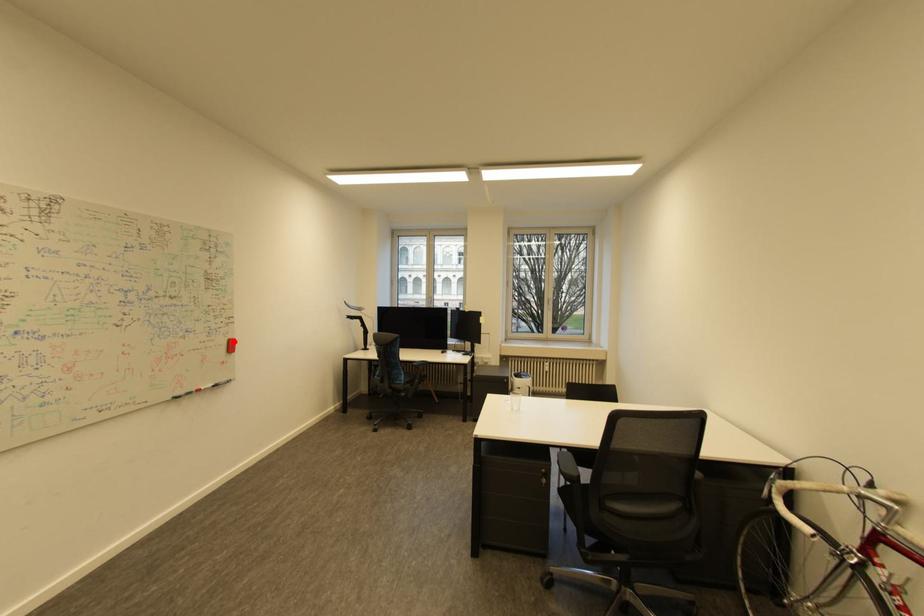
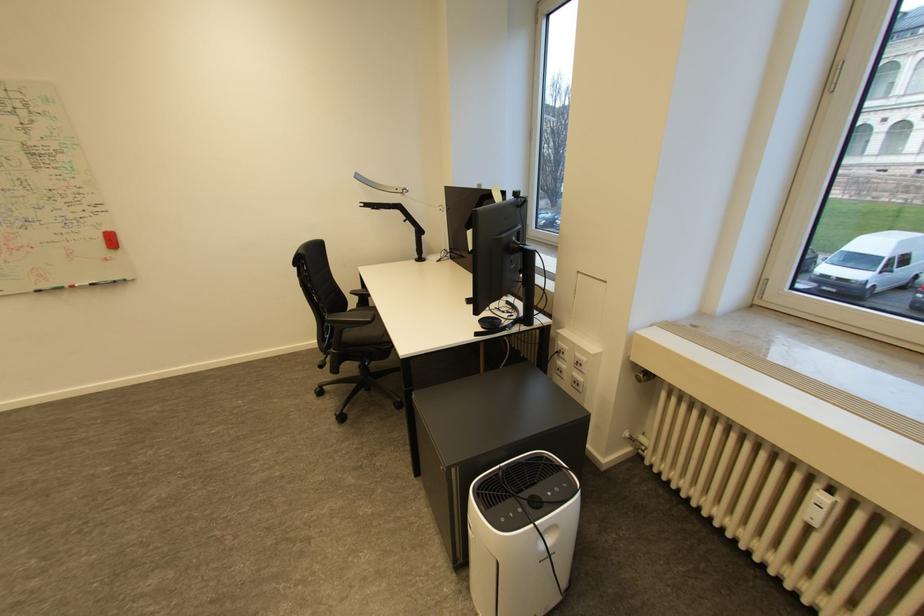
In the second image, find the point that corresponds to the highlighted location in the first image.

(108, 235)